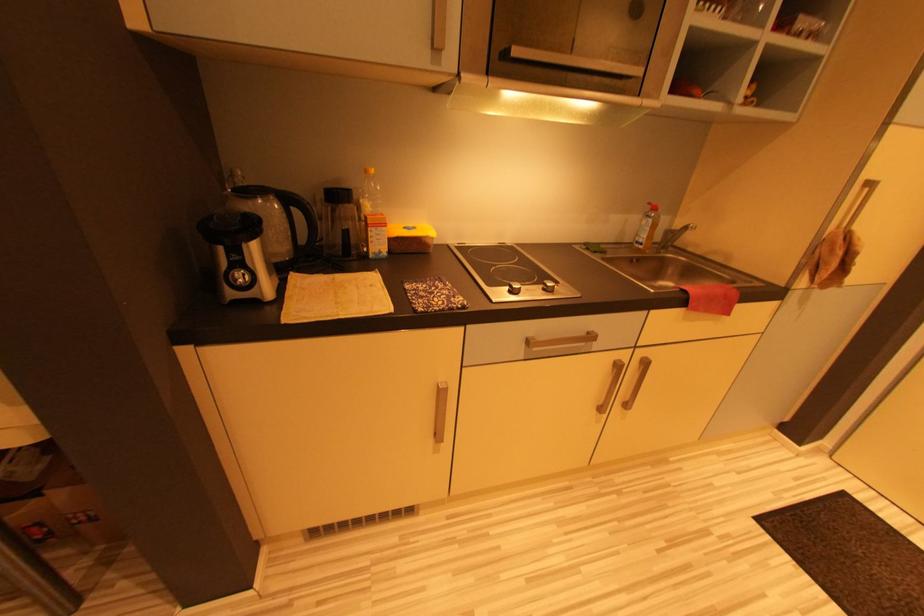
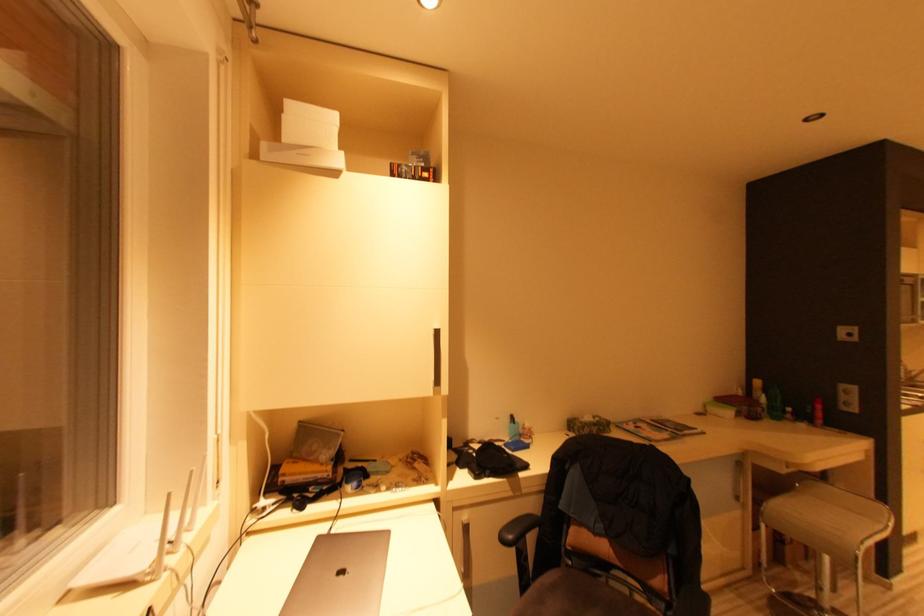
In the scene shown: Which direction would the cameraman need to move to produce the second image?

The movement direction of the cameraman is left, backward.